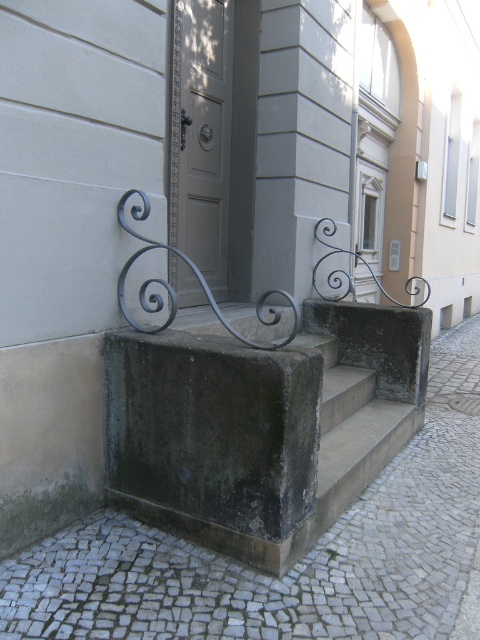
Question: Which point appears farthest from the camera in this image?

Choices:
 (A) (170, 92)
 (B) (189, 266)

Answer: (B)

Question: Which point appears farthest from the camera in this image?

Choices:
 (A) (205, 84)
 (B) (405, 557)
 (C) (263, 300)

Answer: (C)

Question: Is gray concrete pavement at lower center further to the viewer compared to black wrought iron rail at center?

Choices:
 (A) yes
 (B) no

Answer: (B)

Question: Which point is farther from the camera taking this photo?

Choices:
 (A) (180, 1)
 (B) (157, 301)
 (C) (23, 552)

Answer: (A)

Question: Is the position of gray concrete pavement at lower center more distant than that of black wrought iron rail at center?

Choices:
 (A) no
 (B) yes

Answer: (A)

Question: Is gray concrete pavement at lower center wider than black wrought iron rail at center?

Choices:
 (A) no
 (B) yes

Answer: (B)